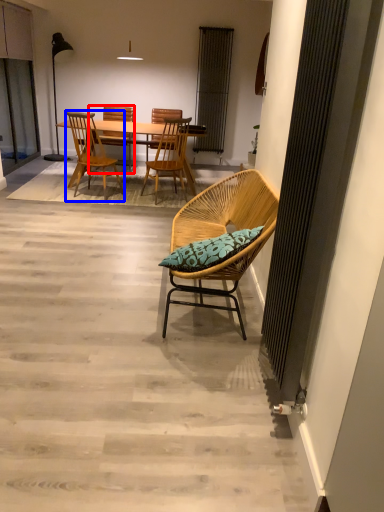
Question: Which of the following is the farthest to the observer, chair (highlighted by a red box) or chair (highlighted by a blue box)?

Choices:
 (A) chair
 (B) chair

Answer: (A)